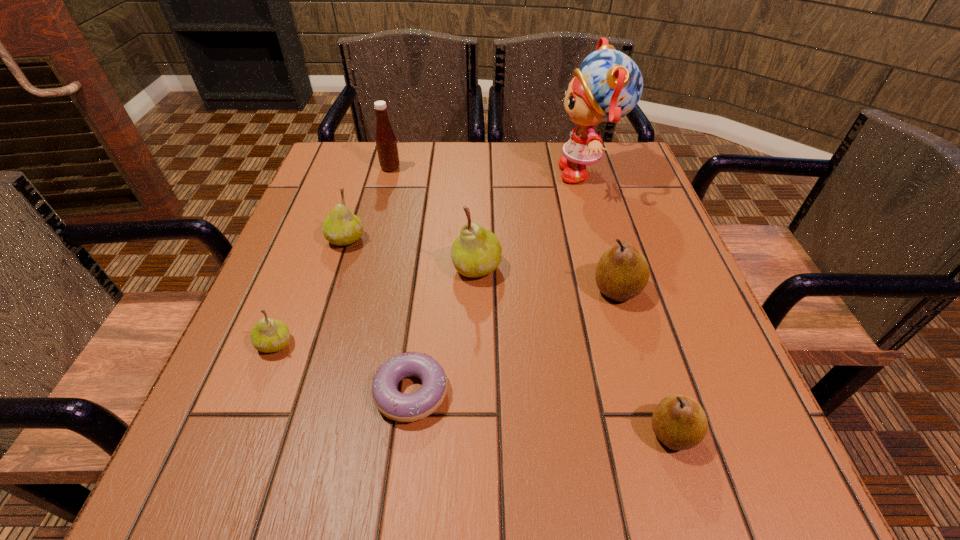
You are a GUI agent. You are given a task and a screenshot of the screen. Output one action in this format:
    pyautogui.click(x=<x>, y=<y>)
    Task: Click on the vacant point located between the Tabasco sauce and the tallest pear
    
    Given the screenshot: What is the action you would take?
    pyautogui.click(x=434, y=218)

This screenshot has height=540, width=960. In order to click on free space between the rightmost green pear and the white Tabasco sauce in this screenshot , I will do `click(434, 218)`.

Locate an element on the screen. This screenshot has width=960, height=540. free space between the doughnut and the smallest green pear is located at coordinates (343, 368).

This screenshot has height=540, width=960. In order to click on vacant point located between the fourth farthest pear and the Tabasco sauce in this screenshot , I will do `click(333, 256)`.

Locate an element on the screen. The height and width of the screenshot is (540, 960). free space between the tallest pear and the smallest green pear is located at coordinates (376, 306).

Locate which object ranks third in proximity to the second biggest green pear. Please provide its 2D coordinates. Your answer should be formatted as a tuple, i.e. [(x, y)], where the tuple contains the x and y coordinates of a point satisfying the conditions above.

[(386, 143)]

Where is `object that is the fourth closest to the shortest object`? object that is the fourth closest to the shortest object is located at coordinates (x=622, y=272).

Point out which pear is positioned as the third nearest to the biggest green pear. Please provide its 2D coordinates. Your answer should be formatted as a tuple, i.e. [(x, y)], where the tuple contains the x and y coordinates of a point satisfying the conditions above.

[(268, 335)]

Select which pear appears as the closest to the third pear from right to left. Please provide its 2D coordinates. Your answer should be formatted as a tuple, i.e. [(x, y)], where the tuple contains the x and y coordinates of a point satisfying the conditions above.

[(622, 272)]

Where is `green pear identified as the closest to the shortest object`? green pear identified as the closest to the shortest object is located at coordinates (268, 335).